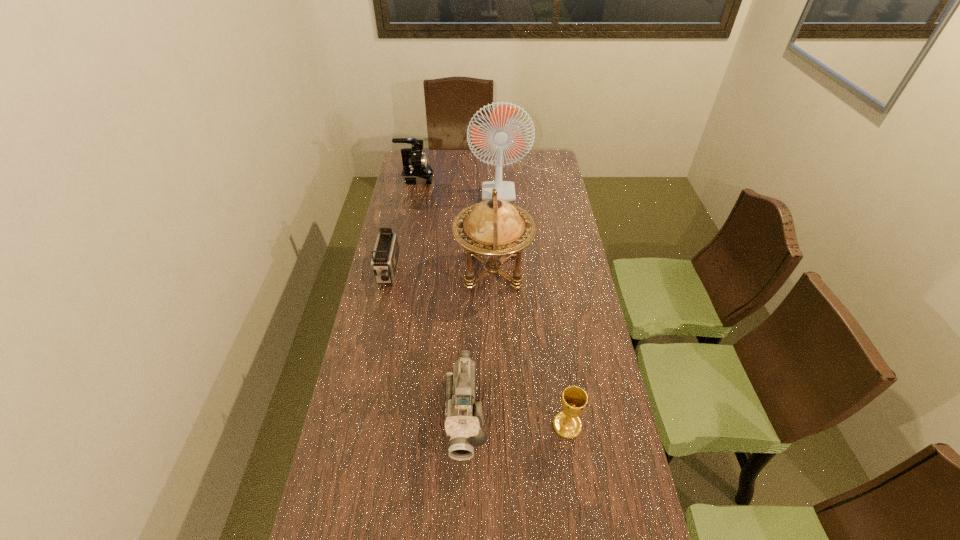
The image size is (960, 540). What are the coordinates of `free point between the tallest object and the nearest camcorder` in the screenshot? It's located at (489, 298).

Find the location of a particular element. object that is the third closest to the tallest object is located at coordinates (385, 257).

Identify which object is the closest to the chalice. Please provide its 2D coordinates. Your answer should be formatted as a tuple, i.e. [(x, y)], where the tuple contains the x and y coordinates of a point satisfying the conditions above.

[(463, 421)]

Identify the location of camcorder that is the third closest one to the fan. (463, 421).

Where is `camcorder that is the second closest to the nearest camcorder`? camcorder that is the second closest to the nearest camcorder is located at coordinates (416, 170).

Where is `vacant space that satisfies the following two spatial constraints: 1. on the front-facing side of the globe; 2. on the front-facing side of the nearest camcorder`? vacant space that satisfies the following two spatial constraints: 1. on the front-facing side of the globe; 2. on the front-facing side of the nearest camcorder is located at coordinates (497, 416).

The height and width of the screenshot is (540, 960). Identify the location of vacant space that satisfies the following two spatial constraints: 1. on the front-facing side of the fifth shortest object; 2. on the front-facing side of the nearest camcorder. (497, 416).

Locate an element on the screen. The image size is (960, 540). vacant space that satisfies the following two spatial constraints: 1. on the front-facing side of the globe; 2. at the lens of the second nearest camcorder is located at coordinates (493, 272).

Locate an element on the screen. This screenshot has width=960, height=540. free space that satisfies the following two spatial constraints: 1. on the front-facing side of the globe; 2. on the front-facing side of the rightmost camcorder is located at coordinates (497, 416).

The height and width of the screenshot is (540, 960). I want to click on vacant area that satisfies the following two spatial constraints: 1. on the lens mount of the farthest camcorder; 2. on the left side of the chalice, so click(370, 425).